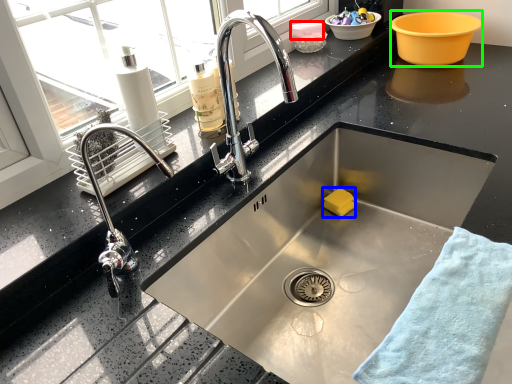
Question: Considering the real-world distances, which object is farthest from basin (highlighted by a red box)? soap (highlighted by a blue box) or basin (highlighted by a green box)?

Choices:
 (A) soap
 (B) basin

Answer: (A)